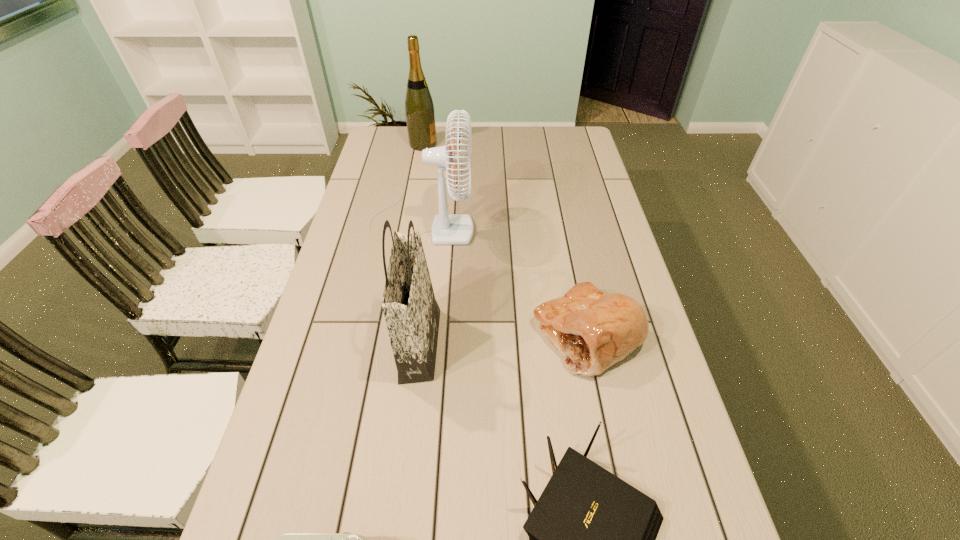
Identify the location of object that is the fifth closest to the bread. (419, 109).